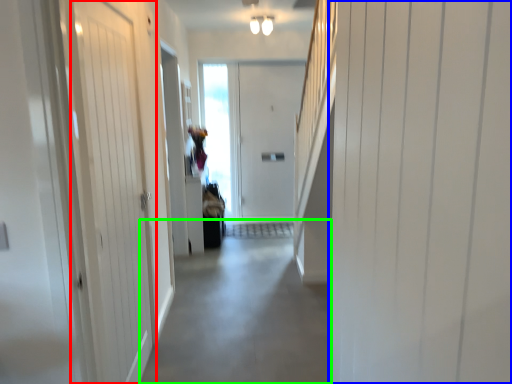
Question: Estimate the real-world distances between objects in this image. Which object is farther from door (highlighted by a red box), door (highlighted by a blue box) or alley (highlighted by a green box)?

Choices:
 (A) door
 (B) alley

Answer: (A)